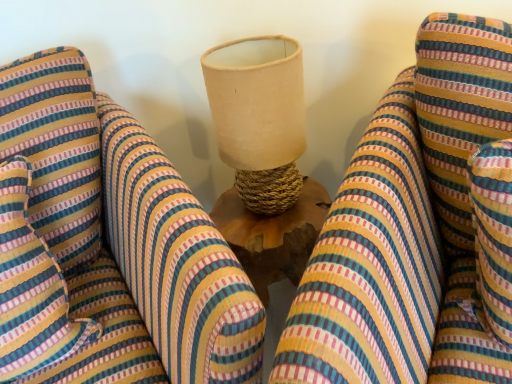
Question: Is striped fabric pillow at left positioned behind striped fabric bean bag chair at center, marked as the 1th bean bag chair in a left-to-right arrangement?

Choices:
 (A) no
 (B) yes

Answer: (B)

Question: From a real-world perspective, does striped fabric pillow at left sit lower than striped fabric bean bag chair at center, the 2th bean bag chair viewed from the right?

Choices:
 (A) no
 (B) yes

Answer: (A)

Question: Is striped fabric pillow at left shorter than striped fabric bean bag chair at center, the 2th bean bag chair viewed from the right?

Choices:
 (A) no
 (B) yes

Answer: (B)

Question: Is striped fabric pillow at left positioned with its back to striped fabric bean bag chair at center, the 2th bean bag chair viewed from the right?

Choices:
 (A) yes
 (B) no

Answer: (A)

Question: From the image's perspective, is striped fabric pillow at left on striped fabric bean bag chair at center, the 2th bean bag chair viewed from the right?

Choices:
 (A) no
 (B) yes

Answer: (B)

Question: Is striped fabric pillow at left bigger than striped fabric bean bag chair at center, the 2th bean bag chair viewed from the right?

Choices:
 (A) no
 (B) yes

Answer: (A)

Question: From the image's perspective, would you say striped fabric bean bag chair at center, which is the 1th bean bag chair from right to left, is shown under beige fabric lampshade at center?

Choices:
 (A) yes
 (B) no

Answer: (A)

Question: Is striped fabric bean bag chair at center, which is the 1th bean bag chair from right to left, to the right of beige fabric lampshade at center from the viewer's perspective?

Choices:
 (A) yes
 (B) no

Answer: (A)

Question: Is striped fabric bean bag chair at center, which ranks as the 2th bean bag chair in left-to-right order, with beige fabric lampshade at center?

Choices:
 (A) no
 (B) yes

Answer: (A)

Question: Can beige fabric lampshade at center be found inside striped fabric bean bag chair at center, which ranks as the 2th bean bag chair in left-to-right order?

Choices:
 (A) yes
 (B) no

Answer: (B)

Question: Could you tell me if striped fabric bean bag chair at center, which is the 1th bean bag chair from right to left, is turned towards beige fabric lampshade at center?

Choices:
 (A) yes
 (B) no

Answer: (B)

Question: Is striped fabric bean bag chair at center, which is the 1th bean bag chair from right to left, smaller than beige fabric lampshade at center?

Choices:
 (A) yes
 (B) no

Answer: (B)

Question: Is striped fabric bean bag chair at center, marked as the 1th bean bag chair in a left-to-right arrangement, taller than striped fabric bean bag chair at center, which is the 1th bean bag chair from right to left?

Choices:
 (A) no
 (B) yes

Answer: (B)